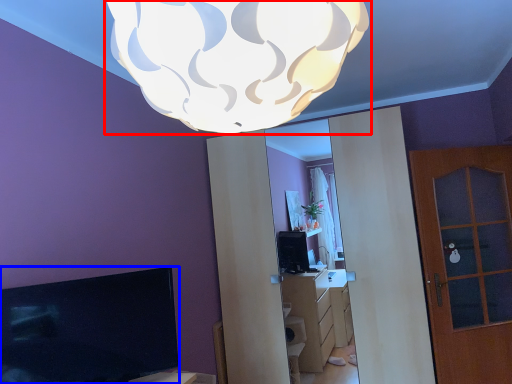
Question: Which object appears farthest to the camera in this image, lamp (highlighted by a red box) or television (highlighted by a blue box)?

Choices:
 (A) lamp
 (B) television

Answer: (B)